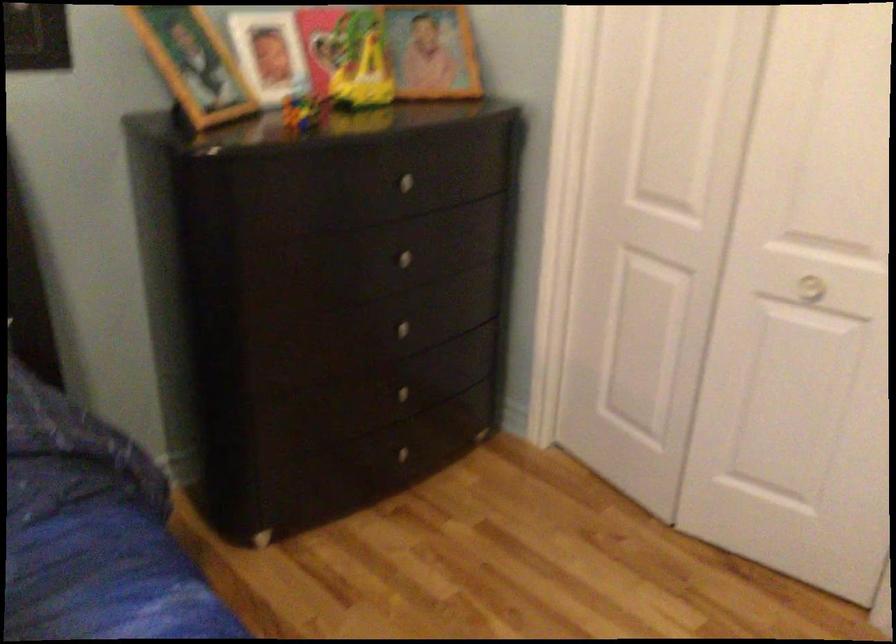
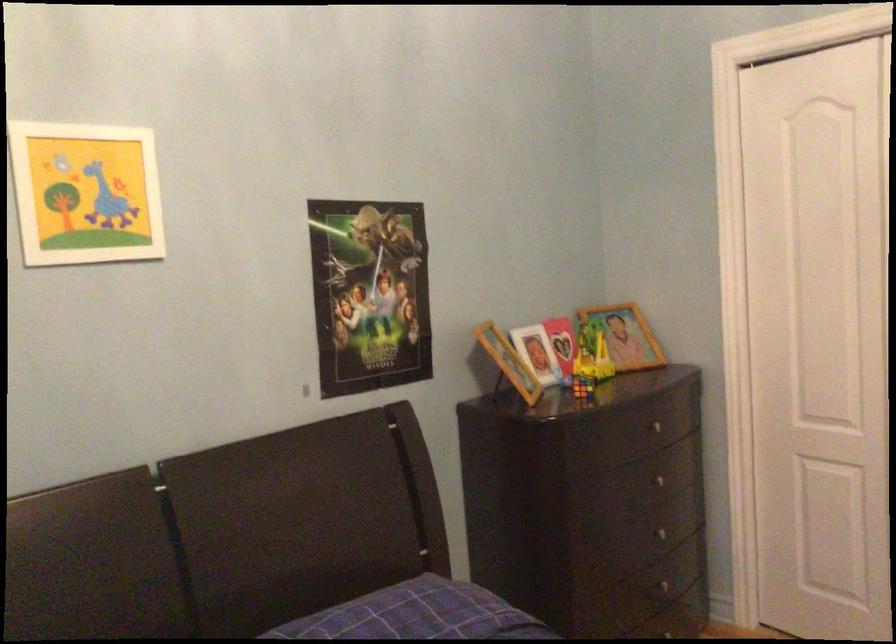
The point at (403, 321) is marked in the first image. Where is the corresponding point in the second image?

(667, 532)